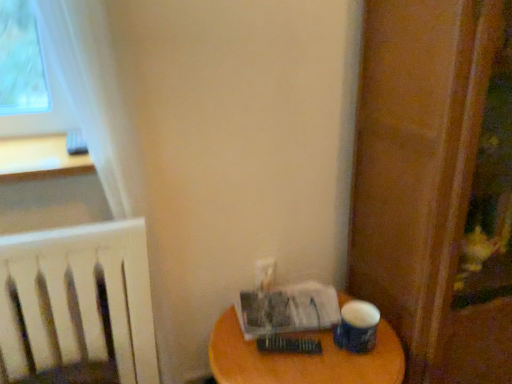
What are the coordinates of `vacant position to the left of blue matte paper cup at lower right` in the screenshot? It's located at (298, 362).